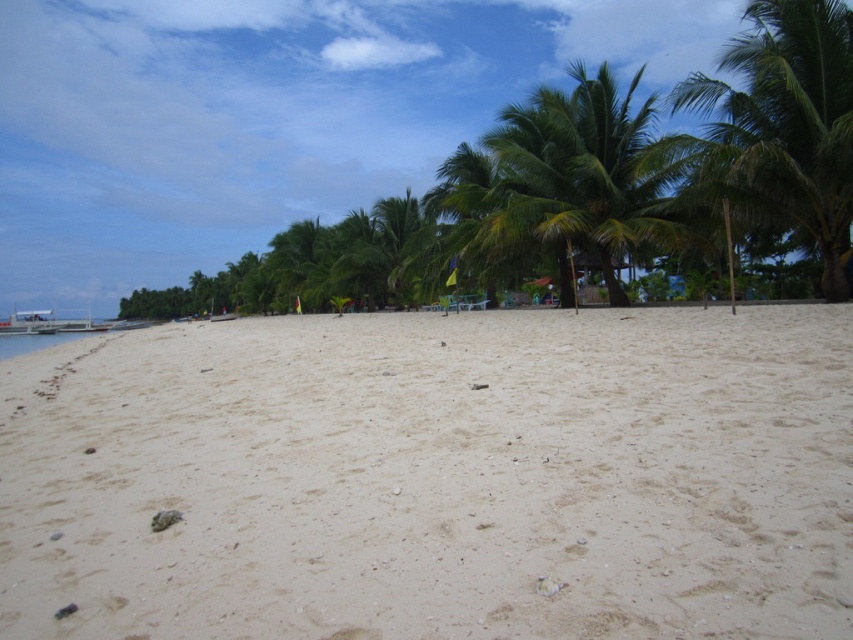
Question: Does white sandy beach at center lie behind green leafy palm tree at right?

Choices:
 (A) no
 (B) yes

Answer: (A)

Question: Does white sandy beach at center have a larger size compared to green leafy palm tree at center?

Choices:
 (A) no
 (B) yes

Answer: (A)

Question: Does white sandy beach at center have a lesser width compared to green leafy palm tree at right?

Choices:
 (A) no
 (B) yes

Answer: (A)

Question: Which is nearer to the white sandy beach at center?

Choices:
 (A) green leafy palm tree at center
 (B) green leafy palm tree at right

Answer: (B)

Question: Which point is closer to the camera taking this photo?

Choices:
 (A) (521, 104)
 (B) (780, 52)
 (C) (477, 323)

Answer: (C)

Question: Which is nearer to the green leafy palm tree at center?

Choices:
 (A) green leafy palm tree at right
 (B) green leafy palm tree at upper right
 (C) white sandy beach at center

Answer: (B)